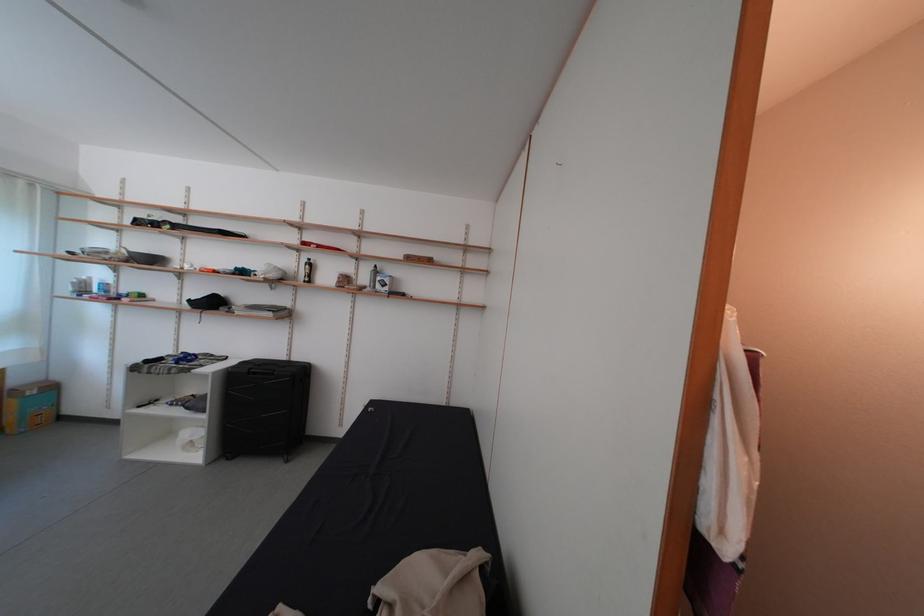
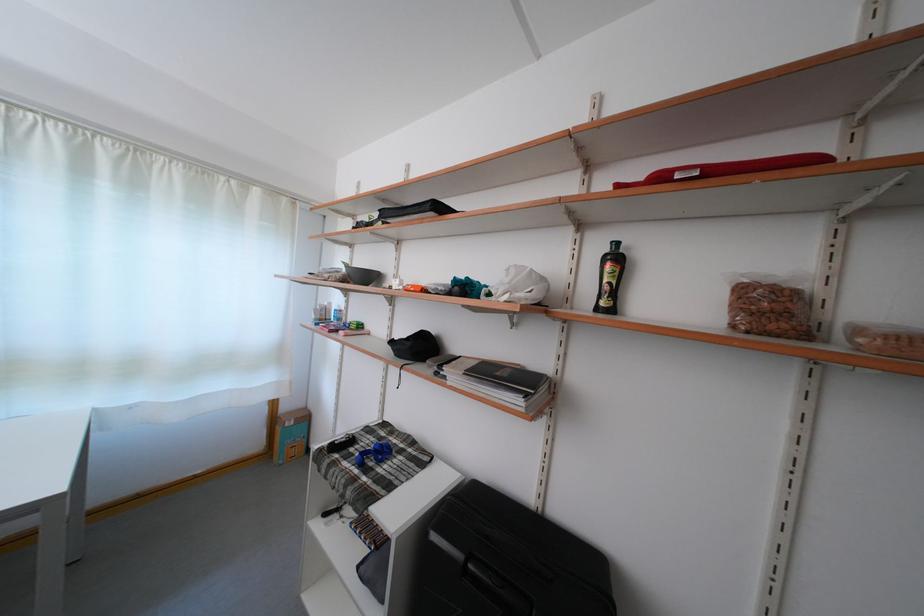
Locate, in the second image, the point that corresponds to point 280,320 in the first image.

(527, 408)